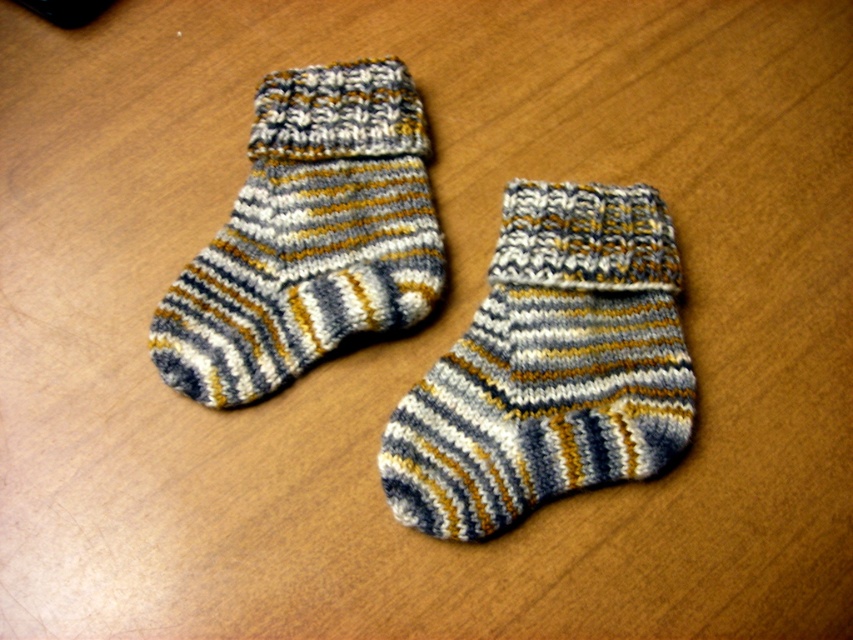
Question: In this image, where is striped woolen sock at center located relative to striped woolen sock at upper left?

Choices:
 (A) above
 (B) below

Answer: (B)

Question: Which object is closer to the camera taking this photo?

Choices:
 (A) striped woolen sock at center
 (B) striped woolen sock at upper left

Answer: (A)

Question: Which object is farther from the camera taking this photo?

Choices:
 (A) striped woolen sock at center
 (B) striped woolen sock at upper left

Answer: (B)

Question: Which of the following is the closest to the observer?

Choices:
 (A) striped woolen sock at center
 (B) striped woolen sock at upper left

Answer: (A)

Question: Can you confirm if striped woolen sock at center is positioned to the right of striped woolen sock at upper left?

Choices:
 (A) yes
 (B) no

Answer: (A)

Question: Is striped woolen sock at center behind striped woolen sock at upper left?

Choices:
 (A) yes
 (B) no

Answer: (B)